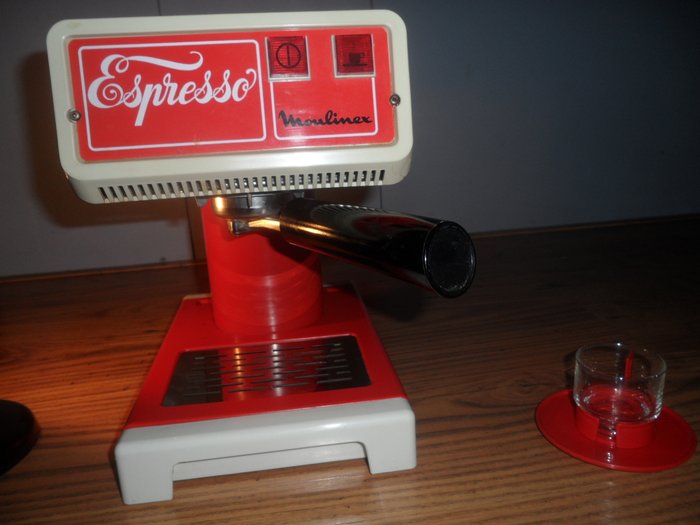
Where is `stand`? This screenshot has width=700, height=525. stand is located at coordinates (267, 262), (355, 429).